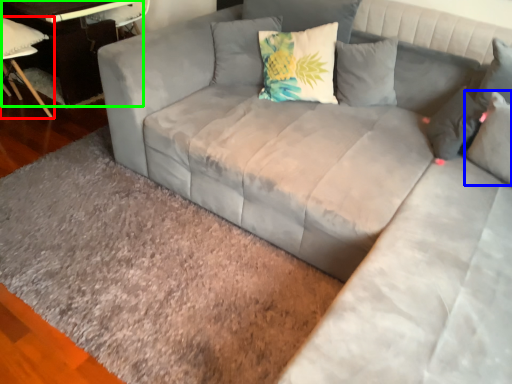
Question: Which is farther away from chair (highlighted by a red box)? pillow (highlighted by a blue box) or table (highlighted by a green box)?

Choices:
 (A) pillow
 (B) table

Answer: (A)